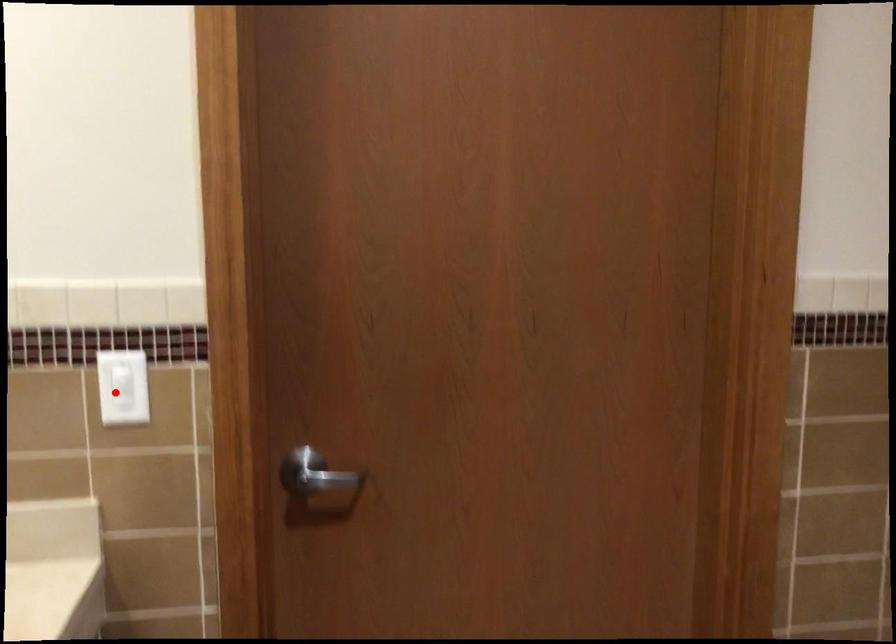
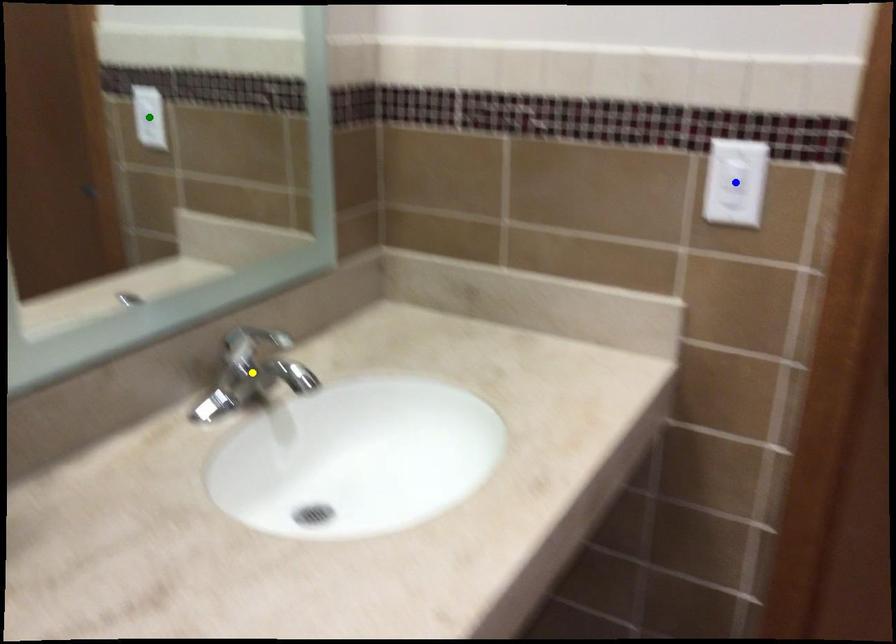
Question: I am providing you with two images of the same scene from different viewpoints. A red point is marked on the first image. You are given multiple points on the second image. Can you choose the point in image 2 that corresponds to the point in image 1?

Choices:
 (A) green point
 (B) blue point
 (C) yellow point

Answer: (B)